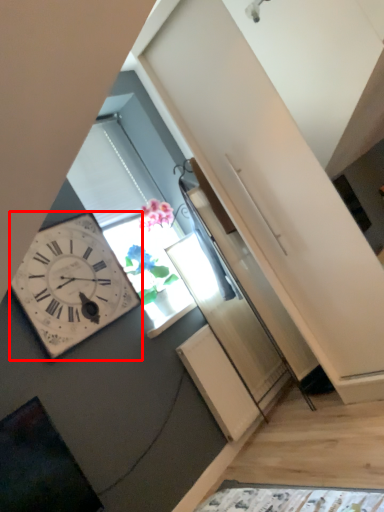
Question: From the image's perspective, what is the correct spatial relationship of wall clock (annotated by the red box) in relation to window?

Choices:
 (A) above
 (B) below

Answer: (B)